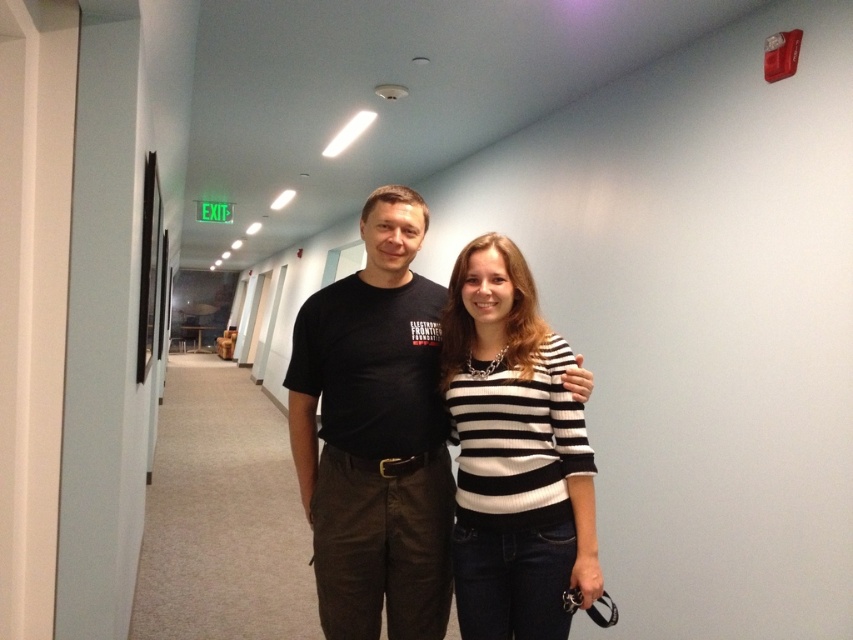
Can you confirm if black cotton shirt at center is positioned above black and white striped sweater at center?

A: Yes, black cotton shirt at center is above black and white striped sweater at center.

How distant is black cotton shirt at center from black and white striped sweater at center?

They are 8.64 inches apart.

Describe the element at coordinates (375, 435) in the screenshot. Image resolution: width=853 pixels, height=640 pixels. I see `black cotton shirt at center` at that location.

Locate an element on the screen. The image size is (853, 640). black cotton shirt at center is located at coordinates (375, 435).